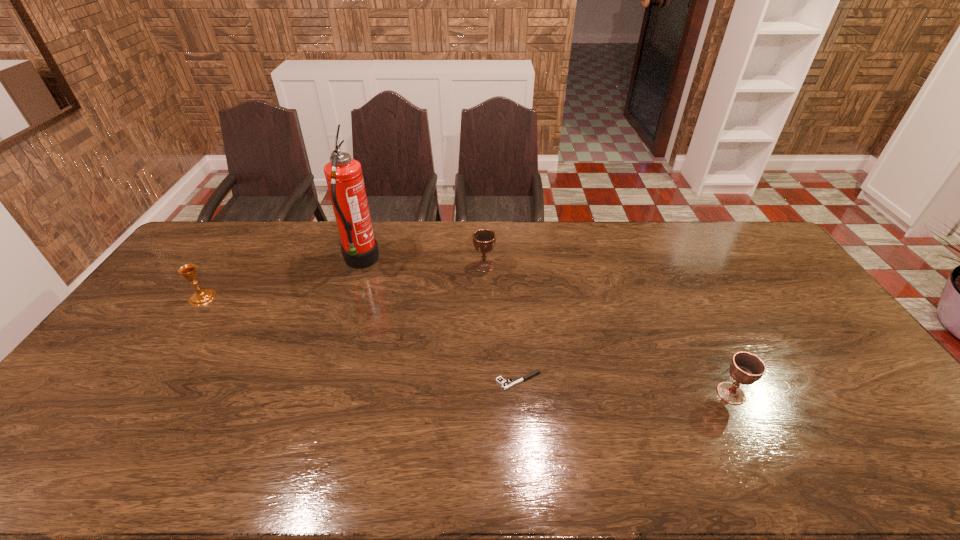
At what (x,y) coordinates should I click in order to perform the action: click on vacant space at the left edge. Please return your answer as a coordinate pair (x, y). The image size is (960, 540). Looking at the image, I should click on (35, 441).

The width and height of the screenshot is (960, 540). I want to click on vacant space at the near left corner of the desktop, so click(46, 467).

The height and width of the screenshot is (540, 960). Find the location of `unoccupied area between the nearest chalice and the second farthest chalice`. unoccupied area between the nearest chalice and the second farthest chalice is located at coordinates (467, 346).

Find the location of `blank region between the pistol and the second chalice from right to left`. blank region between the pistol and the second chalice from right to left is located at coordinates (501, 323).

At what (x,y) coordinates should I click in order to perform the action: click on blank region between the second chalice from left to right and the shortest object. Please return your answer as a coordinate pair (x, y). Image resolution: width=960 pixels, height=540 pixels. Looking at the image, I should click on (501, 323).

Identify the location of free point between the second chalice from left to right and the shortest object. The width and height of the screenshot is (960, 540). (501, 323).

Identify the location of free space between the nearest chalice and the tallest object. This screenshot has height=540, width=960. (546, 328).

At what (x,y) coordinates should I click in order to perform the action: click on free space that is in between the fire extinguisher and the leftmost object. Please return your answer as a coordinate pair (x, y). The image size is (960, 540). Looking at the image, I should click on (281, 280).

Locate an element on the screen. Image resolution: width=960 pixels, height=540 pixels. empty location between the rightmost chalice and the second chalice from left to right is located at coordinates (608, 329).

Where is `unoccupied area between the shortest object and the tallest object`? unoccupied area between the shortest object and the tallest object is located at coordinates (440, 321).